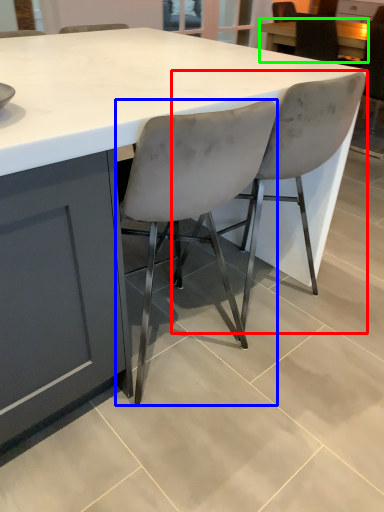
Question: Which is farther away from chair (highlighted by a red box)? chair (highlighted by a blue box) or table (highlighted by a green box)?

Choices:
 (A) chair
 (B) table

Answer: (B)